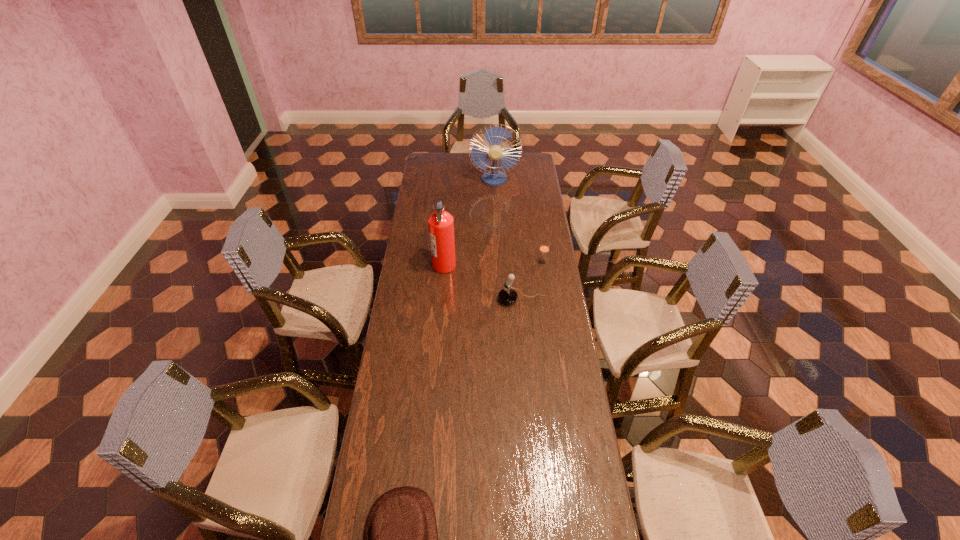
I want to click on fan that is at the right edge, so click(x=494, y=136).

Identify the location of microphone located at the right edge. (507, 295).

Identify the location of straw situated at the right edge. The image size is (960, 540). (544, 248).

The width and height of the screenshot is (960, 540). Identify the location of object located at the far right corner. (494, 136).

Where is `vacant area at the left edge of the desktop`? vacant area at the left edge of the desktop is located at coordinates (401, 272).

Where is `vacant area at the right edge of the desktop`? Image resolution: width=960 pixels, height=540 pixels. vacant area at the right edge of the desktop is located at coordinates (583, 513).

Where is `blank space at the far left corner of the desktop`? This screenshot has height=540, width=960. blank space at the far left corner of the desktop is located at coordinates (435, 157).

Locate an element on the screen. free space between the fourth tallest object and the fan is located at coordinates (518, 221).

What are the coordinates of `blank region between the fire extinguisher and the second shortest object` in the screenshot? It's located at (493, 264).

You are a GUI agent. You are given a task and a screenshot of the screen. Output one action in this format:
    pyautogui.click(x=<x>, y=<y>)
    Task: Click on the vacant space in between the fire extinguisher and the microphone
    
    Given the screenshot: What is the action you would take?
    pyautogui.click(x=483, y=282)